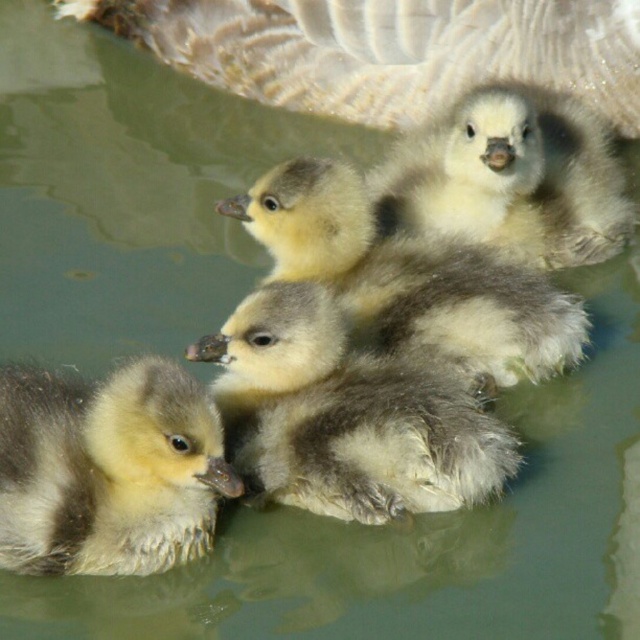
Does gray downy feathers at upper center have a lesser height compared to soft gray downy duckling at center?

Yes, gray downy feathers at upper center is shorter than soft gray downy duckling at center.

Which is more to the left, gray downy feathers at upper center or soft gray downy duckling at center?

From the viewer's perspective, gray downy feathers at upper center appears more on the left side.

Is point (449, 26) farther from viewer compared to point (284, 289)?

Yes, point (449, 26) is behind point (284, 289).

What are the coordinates of `gray downy feathers at upper center` in the screenshot? It's located at (387, 49).

Does point (67, 545) come in front of point (260, 182)?

Yes, it is in front of point (260, 182).

Who is lower down, soft gray downy duckling at lower left or soft yellow duckling at center?

Positioned lower is soft gray downy duckling at lower left.

Image resolution: width=640 pixels, height=640 pixels. What do you see at coordinates (108, 470) in the screenshot?
I see `soft gray downy duckling at lower left` at bounding box center [108, 470].

Locate an element on the screen. The width and height of the screenshot is (640, 640). soft gray downy duckling at lower left is located at coordinates (108, 470).

Looking at this image, is gray downy feathers at upper center above soft gray downy duckling at lower left?

Indeed, gray downy feathers at upper center is positioned over soft gray downy duckling at lower left.

Can you confirm if gray downy feathers at upper center is shorter than soft gray downy duckling at lower left?

In fact, gray downy feathers at upper center may be taller than soft gray downy duckling at lower left.

Is point (232, 42) positioned behind point (108, 436)?

Yes, point (232, 42) is behind point (108, 436).

Where is `gray downy feathers at upper center`? This screenshot has height=640, width=640. gray downy feathers at upper center is located at coordinates (387, 49).